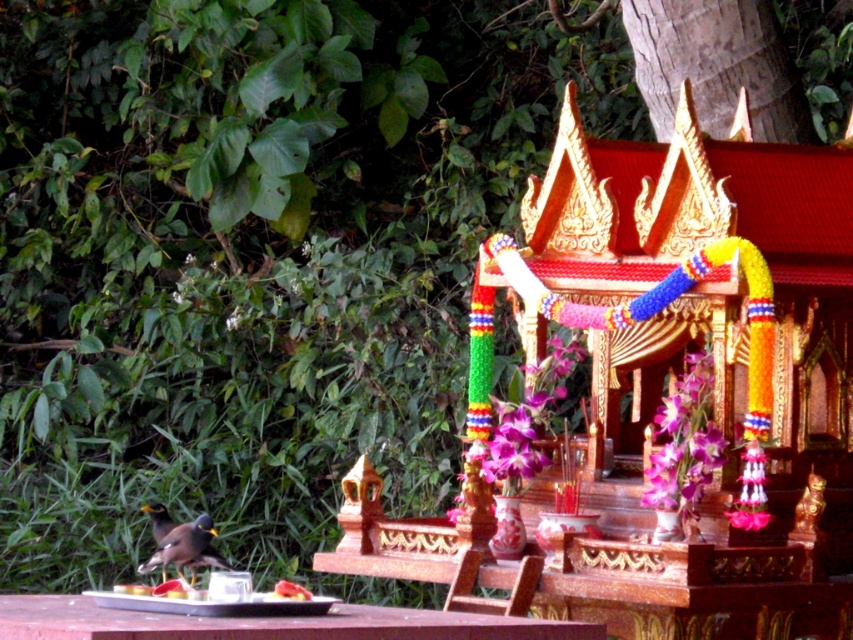
Question: Which point appears closest to the camera in this image?

Choices:
 (A) (283, 595)
 (B) (397, 616)

Answer: (B)

Question: Can you confirm if shiny brown bird at lower left is thinner than smooth red plate at lower center?

Choices:
 (A) no
 (B) yes

Answer: (A)

Question: Which point is closer to the camera?

Choices:
 (A) (302, 598)
 (B) (177, 532)

Answer: (A)

Question: Which point is farther to the camera?

Choices:
 (A) shiny brown bird at lower left
 (B) wooden table at center

Answer: (A)

Question: Is wooden table at center wider than shiny brown bird at lower left?

Choices:
 (A) yes
 (B) no

Answer: (A)

Question: From the image, what is the correct spatial relationship of shiny brown bird at lower left in relation to smooth red plate at lower center?

Choices:
 (A) left
 (B) right

Answer: (A)